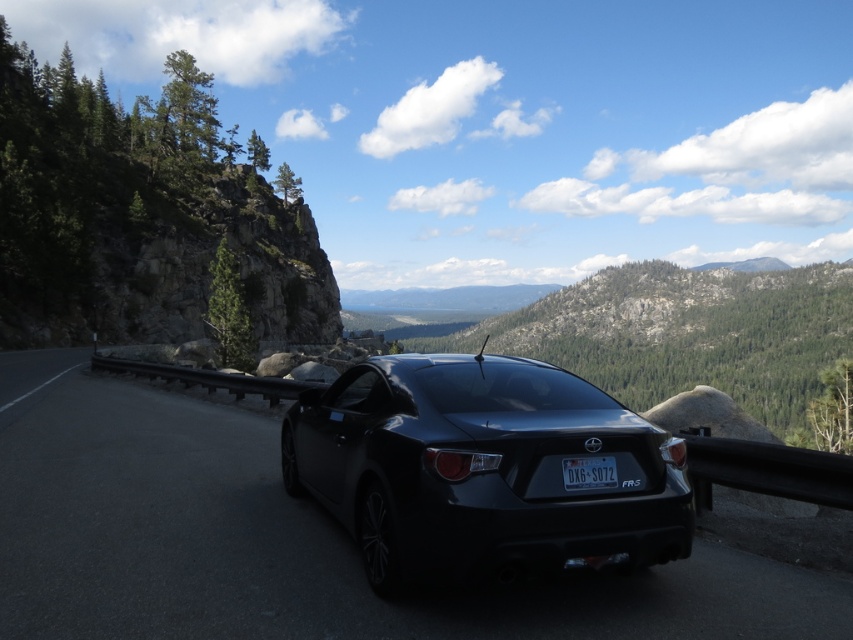
Question: Which of the following is the closest to the observer?

Choices:
 (A) black plastic license plate at center
 (B) black glossy car at center

Answer: (B)

Question: Among these objects, which one is farthest from the camera?

Choices:
 (A) glossy black car at center
 (B) black glossy car at center
 (C) black plastic license plate at center

Answer: (C)

Question: Is black glossy car at center wider than black plastic license plate at center?

Choices:
 (A) yes
 (B) no

Answer: (A)

Question: Which point is closer to the camera?

Choices:
 (A) (370, 481)
 (B) (587, 460)

Answer: (B)

Question: Is black glossy car at center to the right of glossy black car at center from the viewer's perspective?

Choices:
 (A) no
 (B) yes

Answer: (A)

Question: Is black glossy car at center wider than glossy black car at center?

Choices:
 (A) yes
 (B) no

Answer: (A)